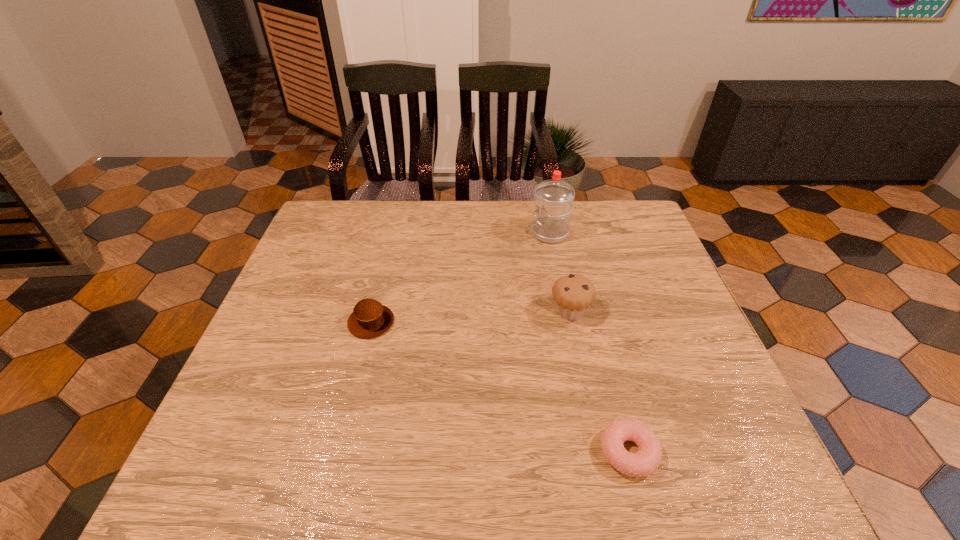
Locate an element on the screen. free space at the far left corner of the desktop is located at coordinates (367, 201).

Identify the location of vacant area at the far right corner of the desktop. (647, 228).

What are the coordinates of `vacant area that lies between the left muffin and the doughnut` in the screenshot? It's located at (500, 387).

The image size is (960, 540). Find the location of `free point between the left muffin and the doughnut`. free point between the left muffin and the doughnut is located at coordinates (500, 387).

Where is `free space between the right muffin and the tallest object`? free space between the right muffin and the tallest object is located at coordinates (560, 273).

Find the location of `free space between the third shortest object and the nearest object`. free space between the third shortest object and the nearest object is located at coordinates (600, 382).

Where is `vacant area between the shorter muffin and the tallest object`? The height and width of the screenshot is (540, 960). vacant area between the shorter muffin and the tallest object is located at coordinates (461, 278).

You are a GUI agent. You are given a task and a screenshot of the screen. Output one action in this format:
    pyautogui.click(x=<x>, y=<y>)
    Task: Click on the vacant space that's between the right muffin and the farthest object
    This screenshot has height=540, width=960.
    Given the screenshot: What is the action you would take?
    pyautogui.click(x=560, y=273)

The image size is (960, 540). Identify the location of unoccupied area between the right muffin and the water bottle. pyautogui.click(x=560, y=273).

The width and height of the screenshot is (960, 540). Find the location of `free space between the right muffin and the doughnut`. free space between the right muffin and the doughnut is located at coordinates (600, 382).